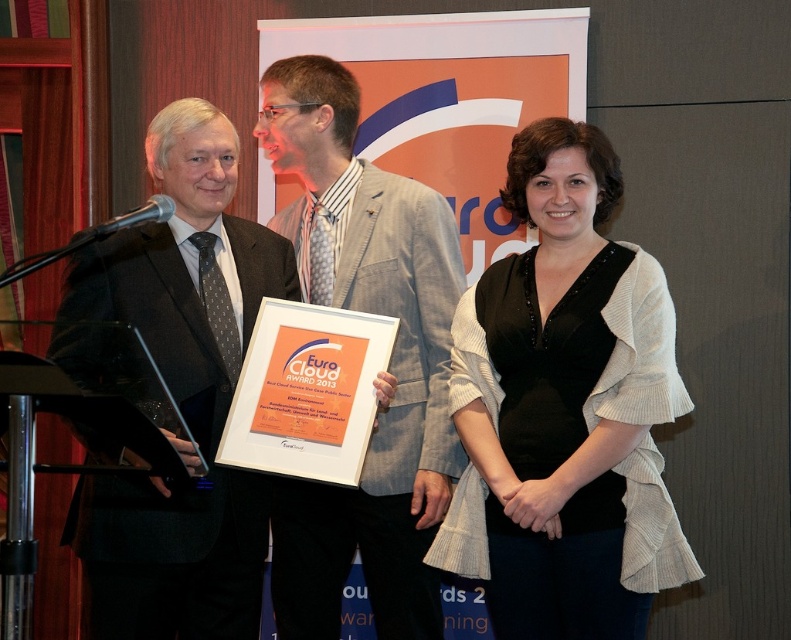
You are a photographer at the event and need to adjust the lighting so that both the light gray textured blazer at center and the matte black suit at center are evenly illuminated. Considering their sizes, which one might require more focused lighting to ensure it doesn

The light gray textured blazer at center is wider than the matte black suit at center, so it might require more focused lighting to ensure it is evenly illuminated compared to the narrower matte black suit at center.